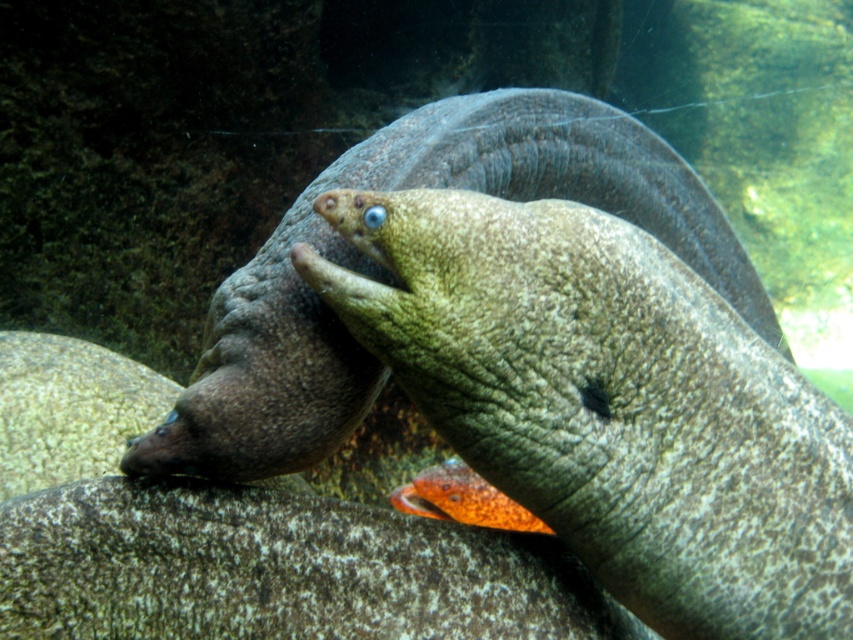
What do you see at coordinates (608, 403) in the screenshot?
I see `smooth orange fish at center` at bounding box center [608, 403].

Can you confirm if smooth orange fish at center is bigger than smooth gray moray eel at center?

Incorrect, smooth orange fish at center is not larger than smooth gray moray eel at center.

This screenshot has height=640, width=853. I want to click on smooth orange fish at center, so click(x=608, y=403).

Who is positioned more to the left, smooth gray moray eel at center or orange glossy fish at center?

Positioned to the left is orange glossy fish at center.

Between point (302, 195) and point (439, 516), which one is positioned behind?

The point (439, 516) is more distant.

The image size is (853, 640). Identify the location of smooth gray moray eel at center. (392, 275).

Does smooth orange fish at center appear over orange glossy fish at center?

Yes.

Looking at this image, can you confirm if smooth orange fish at center is smaller than orange glossy fish at center?

No, smooth orange fish at center is not smaller than orange glossy fish at center.

Which is behind, point (772, 525) or point (440, 512)?

The point (440, 512) is more distant.

Locate an element on the screen. The height and width of the screenshot is (640, 853). smooth orange fish at center is located at coordinates click(x=608, y=403).